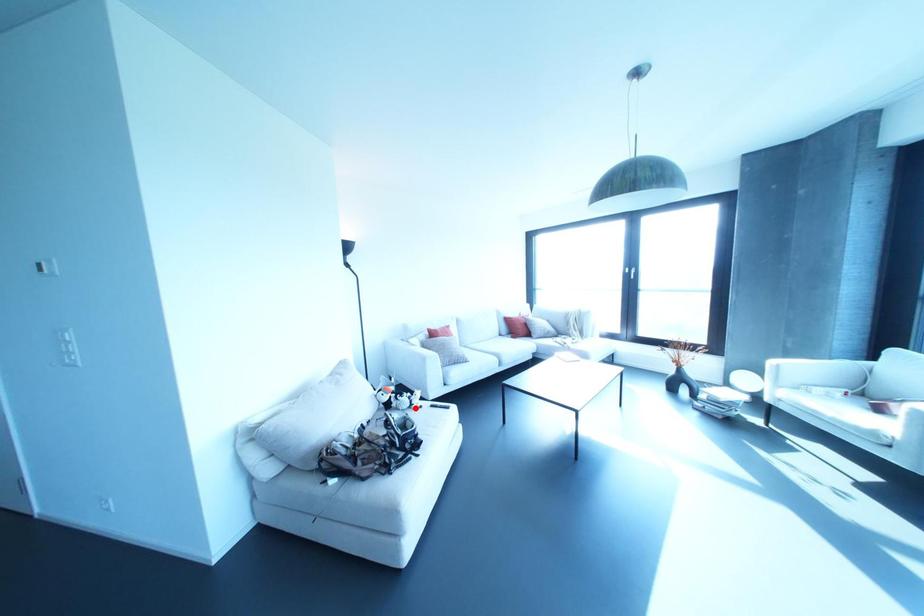
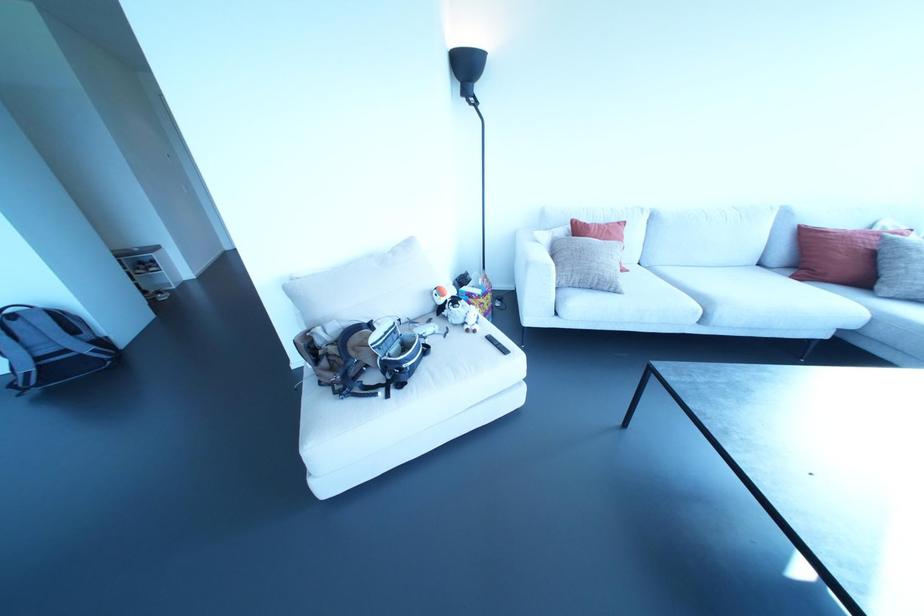
Question: I am providing you with two images of the same scene from different viewpoints. A red point is marked on the first image. Is the red point's position out of view in image 2?

Choices:
 (A) Yes
 (B) No

Answer: (B)